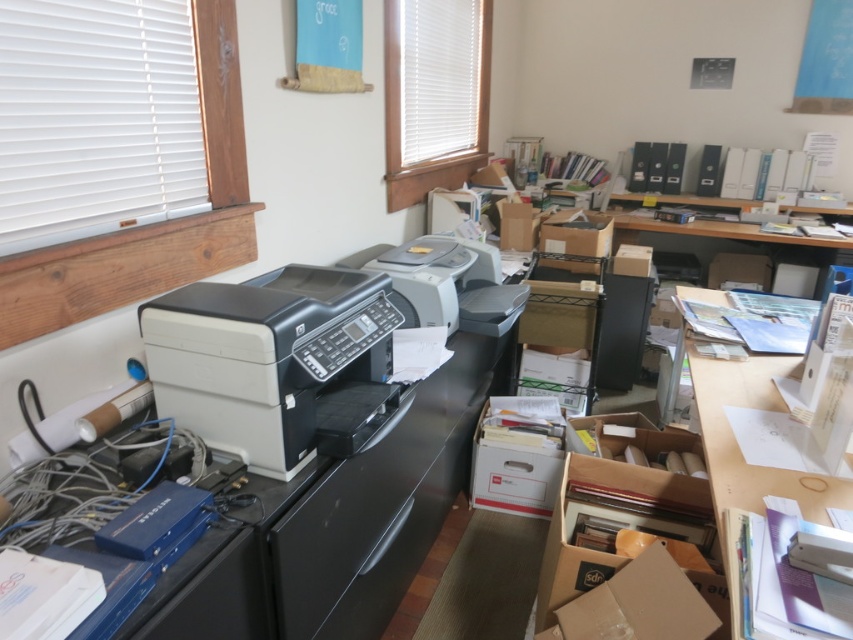
Question: Among these points, which one is nearest to the camera?

Choices:
 (A) (469, 264)
 (B) (569, 237)
 (C) (735, 499)
 (D) (288, 456)

Answer: (D)

Question: Is white paper at upper right closer to the viewer compared to white matte printer at center?

Choices:
 (A) yes
 (B) no

Answer: (A)

Question: Does cardboard at center come behind matte cardboard box at center-right?

Choices:
 (A) yes
 (B) no

Answer: (B)

Question: Which object appears farthest from the camera in this image?

Choices:
 (A) white matte printer at center
 (B) black plastic printer at center
 (C) matte cardboard box at center-right

Answer: (C)

Question: Estimate the real-world distances between objects in this image. Which object is farther from the matte cardboard box at center-right?

Choices:
 (A) black plastic printer at center
 (B) white matte printer at center
 (C) cardboard at center

Answer: (A)

Question: In this image, where is black plastic printer at center located relative to white matte printer at center?

Choices:
 (A) left
 (B) right

Answer: (A)